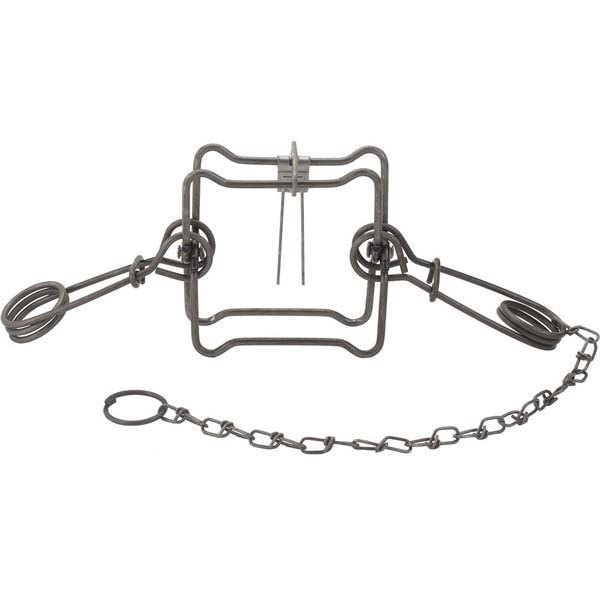
Identify the location of hinge. (298, 159).